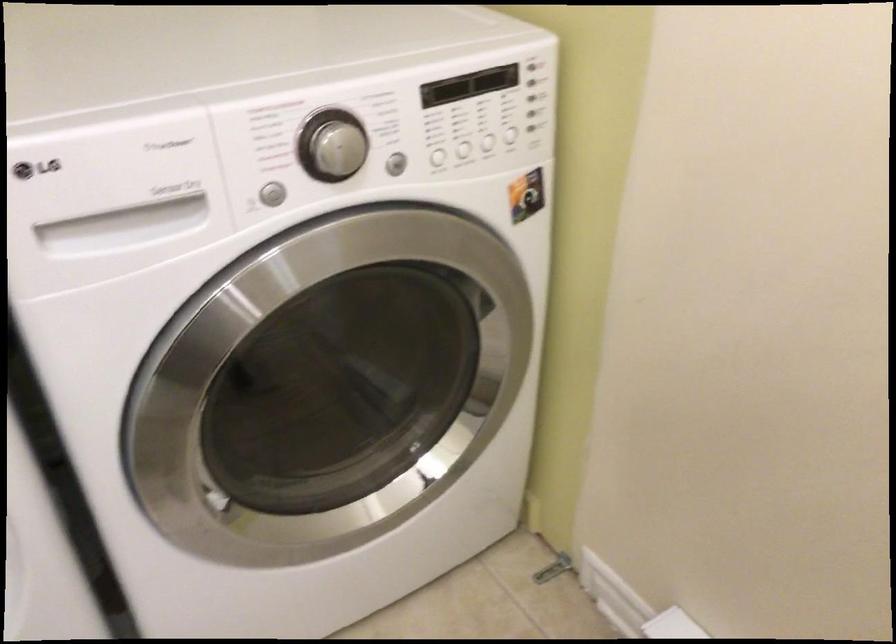
Where would you press the washing machine button? Please return your answer as a coordinate pair (x, y).

(269, 194)